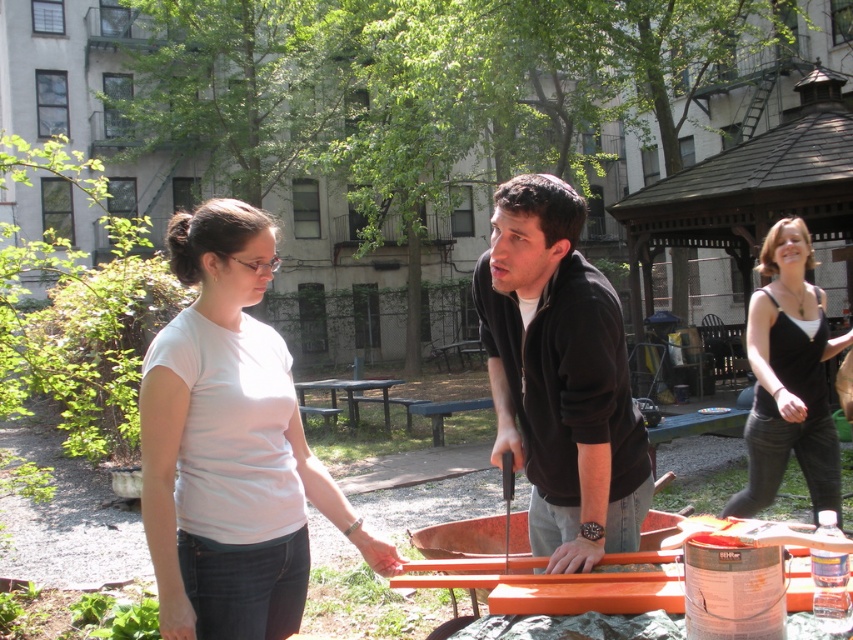
You are a delivery person trying to decide which of the two black clothing items to place a heavy box on without damaging them. The box is wider than the black matte jacket at center but narrower than the black tank top at right. Which clothing item should you choose?

The black tank top at right has a greater width than the black matte jacket at center, so placing the box on the black tank top at right would be more suitable as it can accommodate the box without being damaged.